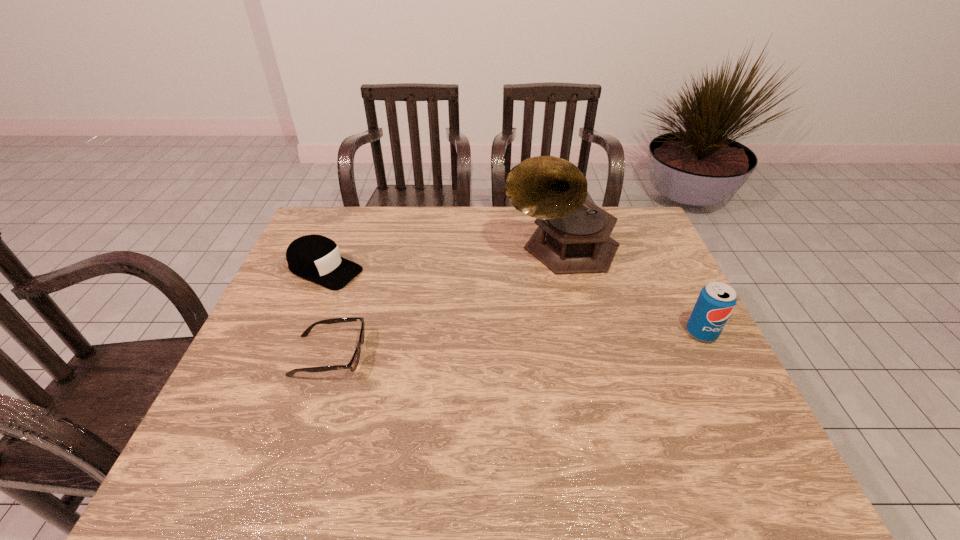
Image resolution: width=960 pixels, height=540 pixels. In order to click on vacant space on the desktop that is between the shortest object and the rightmost object and is positioned on the horn direction of the phonograph record in this screenshot , I will do [x=503, y=345].

This screenshot has width=960, height=540. I want to click on vacant space on the desktop that is between the spectacles and the soda can and is positioned on the front-facing side of the cap, so click(508, 345).